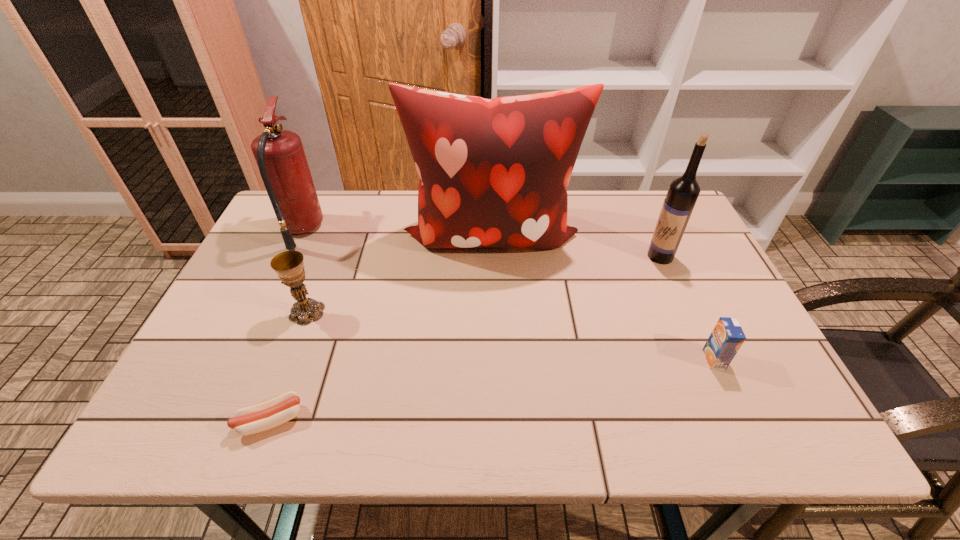
In the image, there is a desktop. Where is `vacant space at the near left corner`? vacant space at the near left corner is located at coordinates (171, 406).

I want to click on free space at the far right corner of the desktop, so click(649, 200).

You are a GUI agent. You are given a task and a screenshot of the screen. Output one action in this format:
    pyautogui.click(x=<x>, y=<y>)
    Task: Click on the free area in between the tallest object and the fourth tallest object
    Image resolution: width=960 pixels, height=540 pixels.
    Given the screenshot: What is the action you would take?
    pyautogui.click(x=398, y=274)

The height and width of the screenshot is (540, 960). In order to click on vacant area that lies between the third shortest object and the nearest object in this screenshot , I will do `click(289, 366)`.

What are the coordinates of `vacant point located between the second nearest object and the fire extinguisher` in the screenshot? It's located at (508, 294).

At what (x,y) coordinates should I click in order to perform the action: click on empty location between the nearest object and the fire extinguisher. Please return your answer as a coordinate pair (x, y). Looking at the image, I should click on (286, 325).

Where is `vacant region between the nearest object and the wine bottle`? vacant region between the nearest object and the wine bottle is located at coordinates (466, 338).

Where is `free space between the wine bottle and the nearest object`? free space between the wine bottle and the nearest object is located at coordinates (466, 338).

The image size is (960, 540). What are the coordinates of `free space between the fire extinguisher and the orange_juice` in the screenshot? It's located at coord(508,294).

Where is `vacant space that's between the wine bottle and the second shortest object`? This screenshot has height=540, width=960. vacant space that's between the wine bottle and the second shortest object is located at coordinates (687, 308).